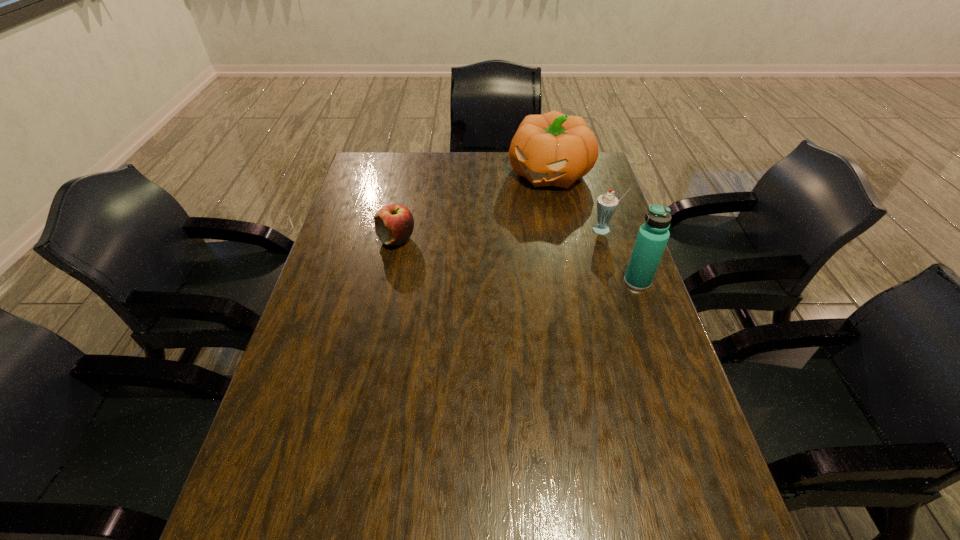
This screenshot has height=540, width=960. What are the coordinates of `vacant space on the desktop that is between the shortest object and the thermos bottle and is positioned on the straw side of the milkshake` in the screenshot? It's located at (539, 264).

Identify the location of vacant spot on the desktop that is between the leftmost object and the thermos bottle and is positioned on the carved face of the farthest object. (479, 254).